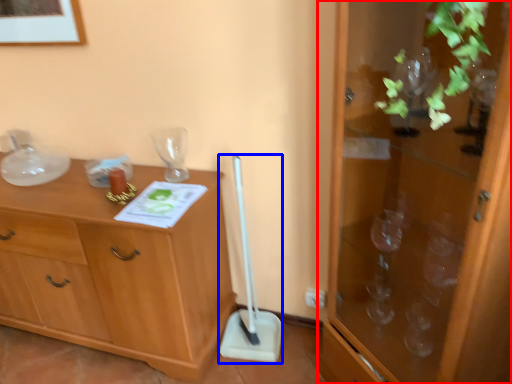
Question: Which object appears closest to the camera in this image, cabinetry (highlighted by a red box) or shovel (highlighted by a blue box)?

Choices:
 (A) cabinetry
 (B) shovel

Answer: (A)